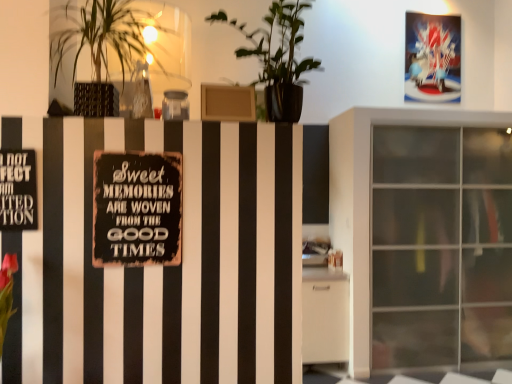
Question: Could black metal sign at left be considered to be inside green matte plant at upper center, which appears as the first houseplant when viewed from the right?

Choices:
 (A) yes
 (B) no

Answer: (B)

Question: From a real-world perspective, is green matte plant at upper center, the second houseplant viewed from the left, below black metal sign at left?

Choices:
 (A) no
 (B) yes

Answer: (A)

Question: Are green matte plant at upper center, which appears as the first houseplant when viewed from the right, and black metal sign at left making contact?

Choices:
 (A) no
 (B) yes

Answer: (A)

Question: Is green matte plant at upper center, the second houseplant viewed from the left, located outside black metal sign at left?

Choices:
 (A) yes
 (B) no

Answer: (A)

Question: Does green matte plant at upper center, which appears as the first houseplant when viewed from the right, turn towards black metal sign at left?

Choices:
 (A) yes
 (B) no

Answer: (B)

Question: Is point (348, 243) closer or farther from the camera than point (110, 9)?

Choices:
 (A) farther
 (B) closer

Answer: (A)

Question: Is transparent glass cabinet at right taller or shorter than green leafy plant at upper left, which is the first houseplant from left to right?

Choices:
 (A) tall
 (B) short

Answer: (A)

Question: Is transparent glass cabinet at right situated inside green leafy plant at upper left, which is the first houseplant from left to right, or outside?

Choices:
 (A) inside
 (B) outside

Answer: (B)

Question: From a real-world perspective, relative to green leafy plant at upper left, which appears as the second houseplant when viewed from the right, is transparent glass cabinet at right vertically above or below?

Choices:
 (A) above
 (B) below

Answer: (B)

Question: In terms of height, does rusty metal sign at center look taller or shorter compared to green matte plant at upper center, which appears as the first houseplant when viewed from the right?

Choices:
 (A) tall
 (B) short

Answer: (B)

Question: Is rusty metal sign at center wider or thinner than green matte plant at upper center, the second houseplant viewed from the left?

Choices:
 (A) wide
 (B) thin

Answer: (B)

Question: Which is correct: rusty metal sign at center is inside green matte plant at upper center, the second houseplant viewed from the left, or outside of it?

Choices:
 (A) outside
 (B) inside

Answer: (A)

Question: From the image's perspective, is rusty metal sign at center above or below green matte plant at upper center, which appears as the first houseplant when viewed from the right?

Choices:
 (A) below
 (B) above

Answer: (A)

Question: In terms of size, does rusty metal sign at center appear bigger or smaller than black metal sign at left?

Choices:
 (A) small
 (B) big

Answer: (B)

Question: Which is correct: rusty metal sign at center is inside black metal sign at left, or outside of it?

Choices:
 (A) inside
 (B) outside

Answer: (B)